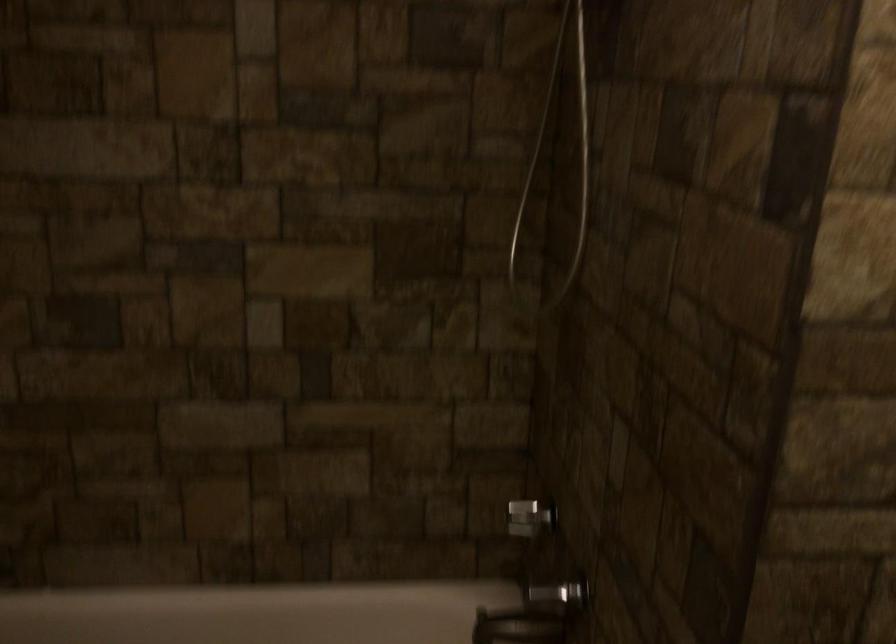
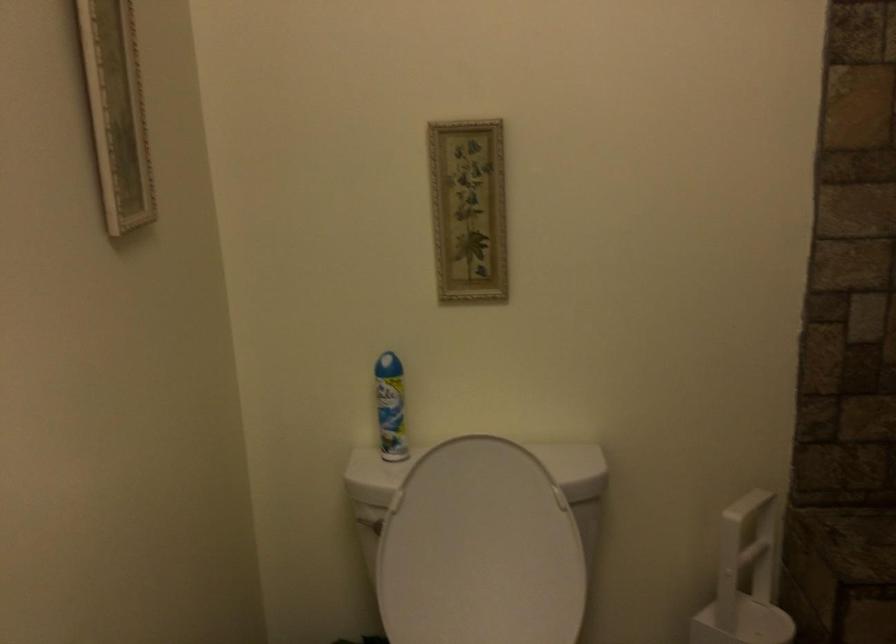
Question: The camera is either moving clockwise (left) or counter-clockwise (right) around the object. The first image is from the beginning of the video and the second image is from the end. Is the camera moving left or right when shooting the video?

Choices:
 (A) Left
 (B) Right

Answer: (B)